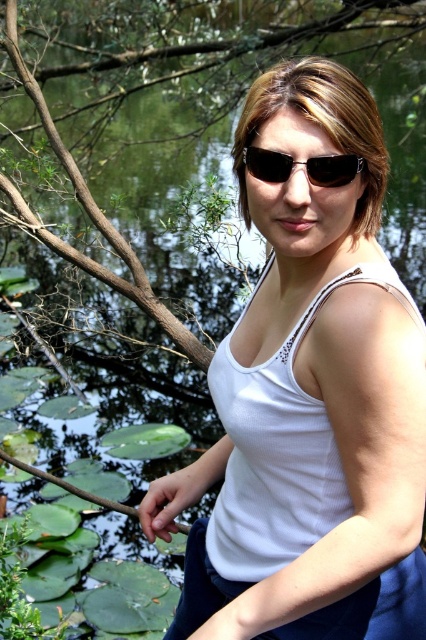
Is white matte tank top at center closer to camera compared to black plastic sunglasses at center?

That is True.

Describe the element at coordinates (310, 400) in the screenshot. The image size is (426, 640). I see `white matte tank top at center` at that location.

The width and height of the screenshot is (426, 640). In order to click on white matte tank top at center in this screenshot , I will do `click(310, 400)`.